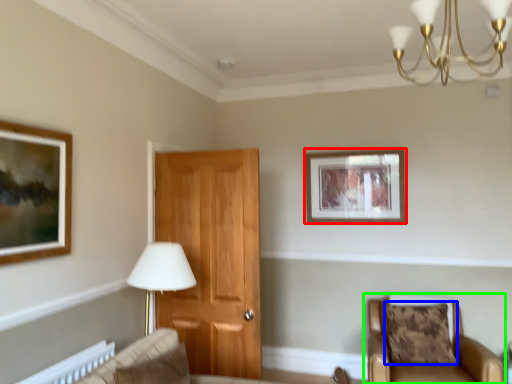
Question: Which is farther away from picture frame (highlighted by a red box)? pillow (highlighted by a blue box) or chair (highlighted by a green box)?

Choices:
 (A) pillow
 (B) chair

Answer: (B)